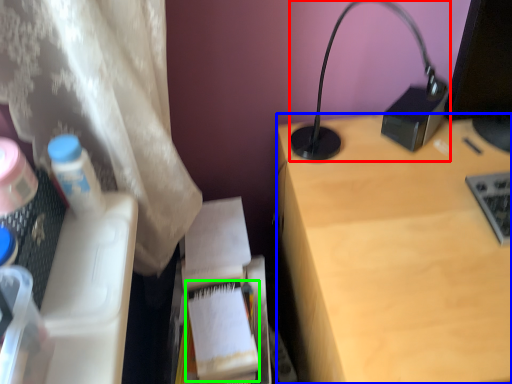
Question: Which object is the farthest from lamp (highlighted by a red box)? Choose among these: desk (highlighted by a blue box) or paperback book (highlighted by a green box).

Choices:
 (A) desk
 (B) paperback book

Answer: (B)